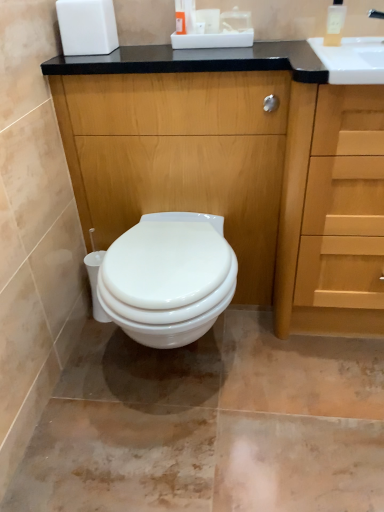
Question: Is point (342, 10) closer or farther from the camera than point (296, 137)?

Choices:
 (A) farther
 (B) closer

Answer: (A)

Question: Is translucent plastic soap dispenser at upper right spatially inside wooden cabinet at center, or outside of it?

Choices:
 (A) outside
 (B) inside

Answer: (A)

Question: Which of these objects is positioned closest to the wooden cabinet at center?

Choices:
 (A) translucent plastic soap dispenser at upper right
 (B) white matte toilet paper at upper center
 (C) light wood drawer at right

Answer: (C)

Question: Based on their relative distances, which object is farther from the light wood drawer at right?

Choices:
 (A) translucent plastic soap dispenser at upper right
 (B) wooden cabinet at center
 (C) white matte toilet paper at upper center

Answer: (C)